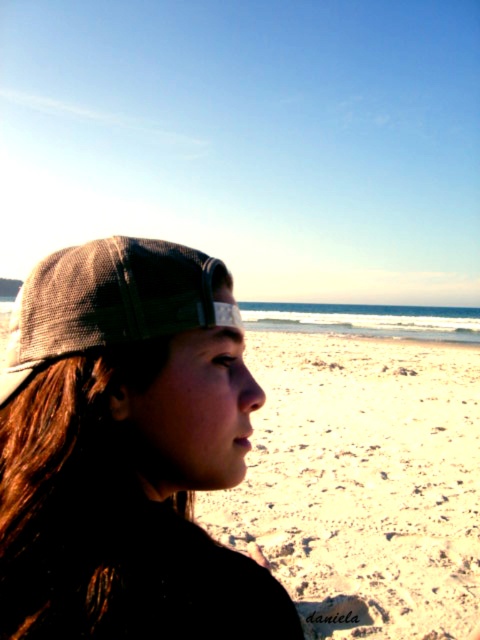
You are standing on the beach and see two points marked on the sand. The first point is at coordinates point [110,253] and the second is at point [165,253]. Which point is closer to you?

Point [110,253] is closer to the viewer than point [165,253].

You are a photographer trying to capture the sunset at the beach. You notice the brown mesh cap at left in your frame. Where should you position your camera to ensure the cap is centered in the shot?

To center the brown mesh cap at left in your shot, position your camera so that the cap is aligned with the center point of your viewfinder at coordinates approximately 0.705 on the x and 0.265 on the y axis.